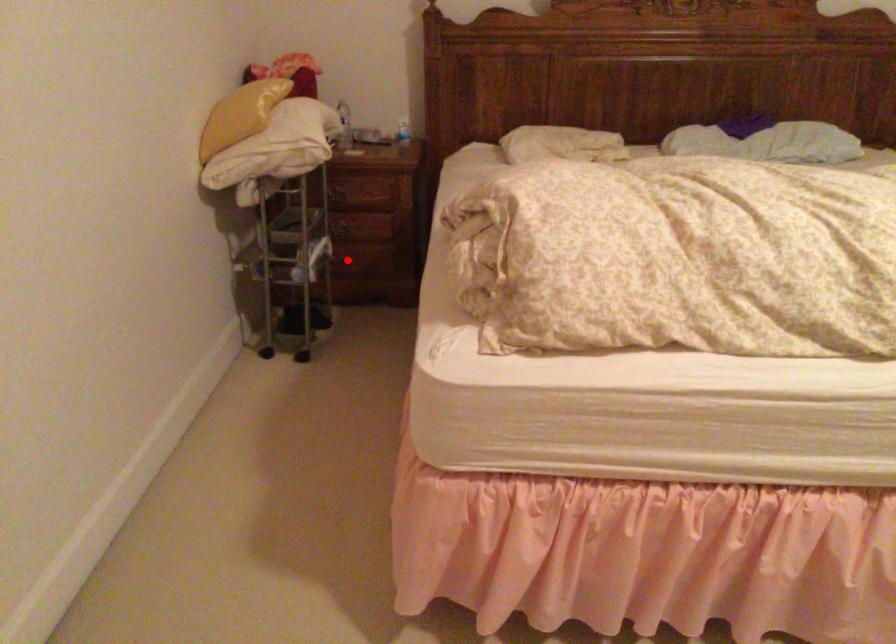
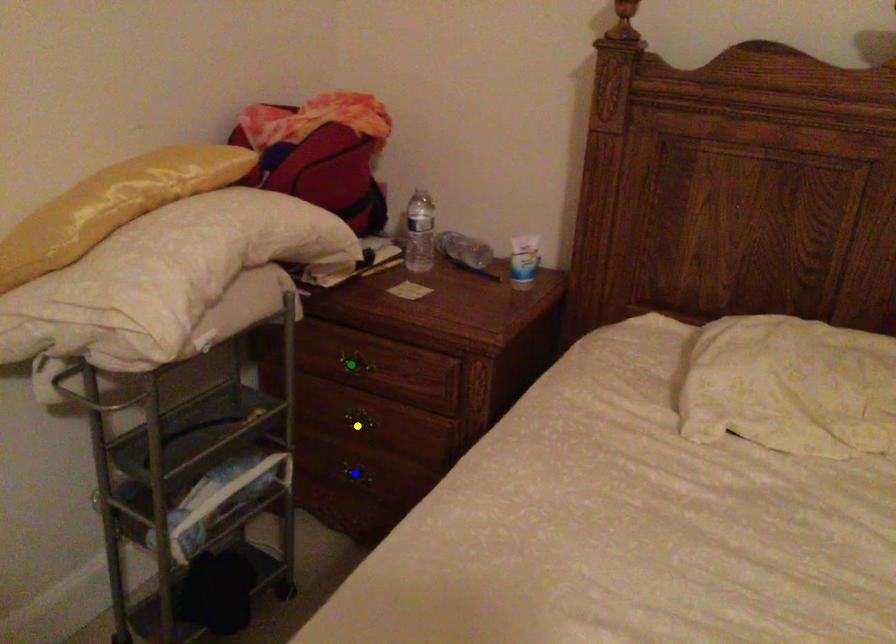
Question: I am providing you with two images of the same scene from different viewpoints. A red point is marked on the first image. You are given multiple points on the second image. Which point in image 2 represents the same 3d spot as the red point in image 1?

Choices:
 (A) green point
 (B) blue point
 (C) yellow point

Answer: (B)